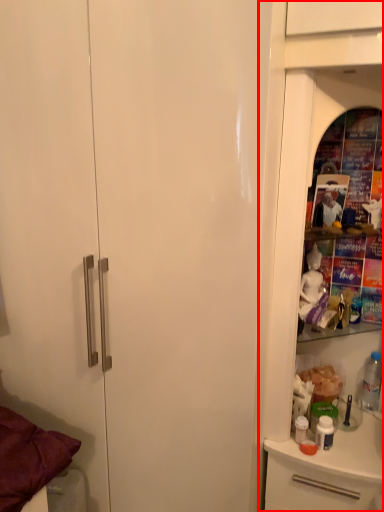
Question: From the image's perspective, where is dresser (annotated by the red box) located relative to bottle?

Choices:
 (A) above
 (B) below

Answer: (A)